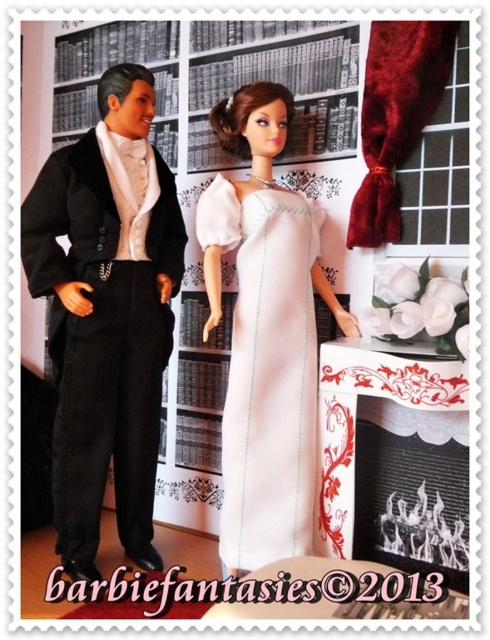
Between satin black suit at left and velvet black tuxedo at left, which one appears on the right side from the viewer's perspective?

satin black suit at left is more to the right.

Looking at this image, who is lower down, satin black suit at left or velvet black tuxedo at left?

Positioned lower is satin black suit at left.

From the picture: Who is more distant from viewer, (97, 438) or (106, 310)?

Positioned behind is point (97, 438).

Image resolution: width=490 pixels, height=640 pixels. I want to click on satin black suit at left, so click(x=106, y=316).

Image resolution: width=490 pixels, height=640 pixels. Describe the element at coordinates (106, 316) in the screenshot. I see `velvet black tuxedo at left` at that location.

Between velvet black tuxedo at left and white satin dress at center, which one appears on the right side from the viewer's perspective?

Result: Positioned to the right is white satin dress at center.

Between point (147, 490) and point (293, 256), which one is positioned behind?

The point (147, 490) is behind.

Identify the location of velvet black tuxedo at left. (106, 316).

Between point (120, 467) and point (225, 500), which one is positioned in front?

Point (225, 500) is more forward.

Who is shorter, satin black suit at left or white satin dress at center?

Standing shorter between the two is white satin dress at center.

Describe the element at coordinates (106, 316) in the screenshot. This screenshot has height=640, width=490. I see `satin black suit at left` at that location.

The image size is (490, 640). I want to click on satin black suit at left, so click(106, 316).